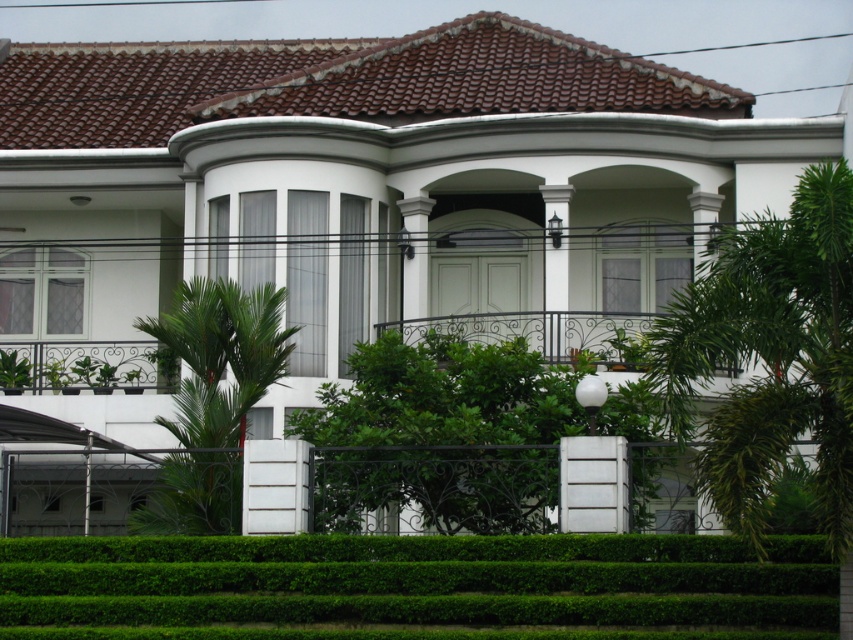
Between green leafy hedge at lower center and green leafy hedge at center, which one is positioned higher?

→ Positioned higher is green leafy hedge at center.

Consider the image. Who is more forward, (206, 579) or (556, 432)?

Point (206, 579)

Locate an element on the screen. This screenshot has height=640, width=853. green leafy hedge at lower center is located at coordinates (415, 586).

Between green leafy hedge at lower center and green leafy palm tree at center, which one appears on the right side from the viewer's perspective?

Positioned to the right is green leafy hedge at lower center.

Who is higher up, green leafy hedge at lower center or green leafy palm tree at center?

green leafy palm tree at center is higher up.

Measure the distance between point (56, 595) and camera.

A distance of 116.80 feet exists between point (56, 595) and camera.

Where is `green leafy hedge at lower center`? The image size is (853, 640). green leafy hedge at lower center is located at coordinates [415, 586].

Which is above, green leafy hedge at lower center or green leafy palm tree at right?

green leafy palm tree at right is higher up.

Which is behind, point (469, 616) or point (784, 355)?

Point (469, 616)

I want to click on green leafy hedge at lower center, so click(415, 586).